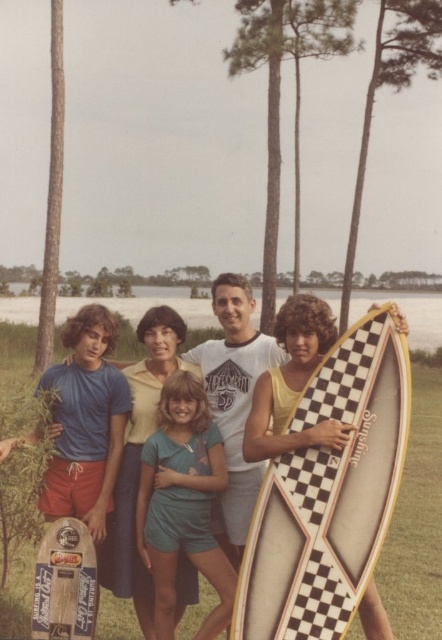
You are a photographer trying to capture the surfboards in the image. Which surfboard is positioned higher in the frame, the matte black surfboard at center or the white checkered surfboard at center?

The matte black surfboard at center is positioned higher in the frame because it is located above the white checkered surfboard at center.